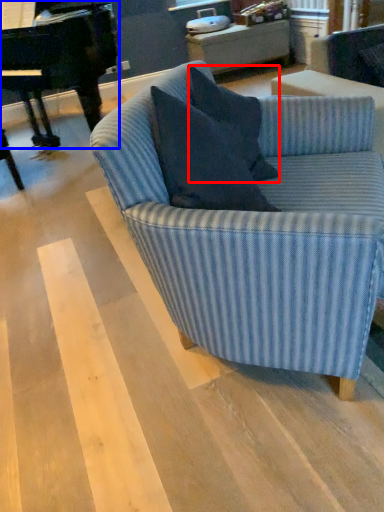
Question: Which point is further to the camera, pillow (highlighted by a red box) or piano (highlighted by a blue box)?

Choices:
 (A) pillow
 (B) piano

Answer: (B)